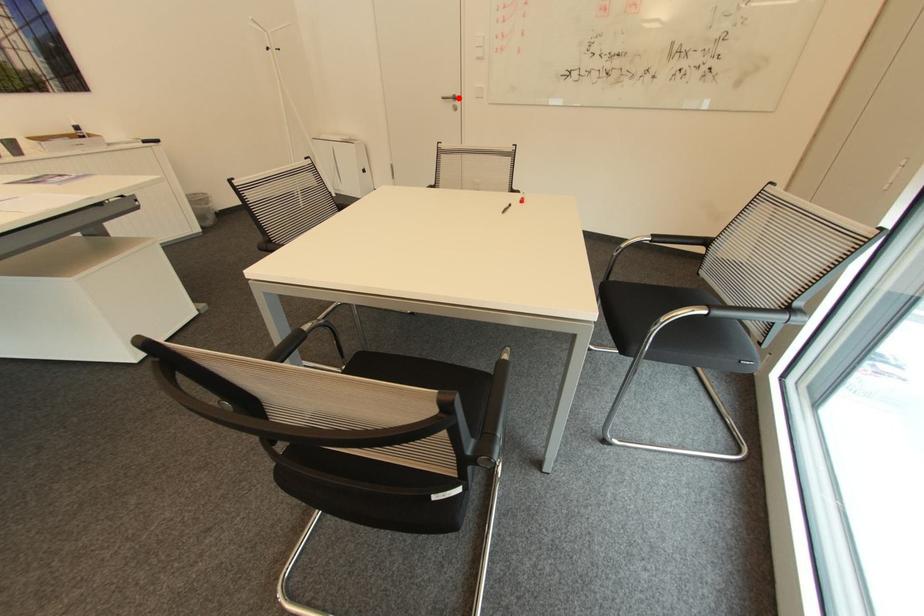
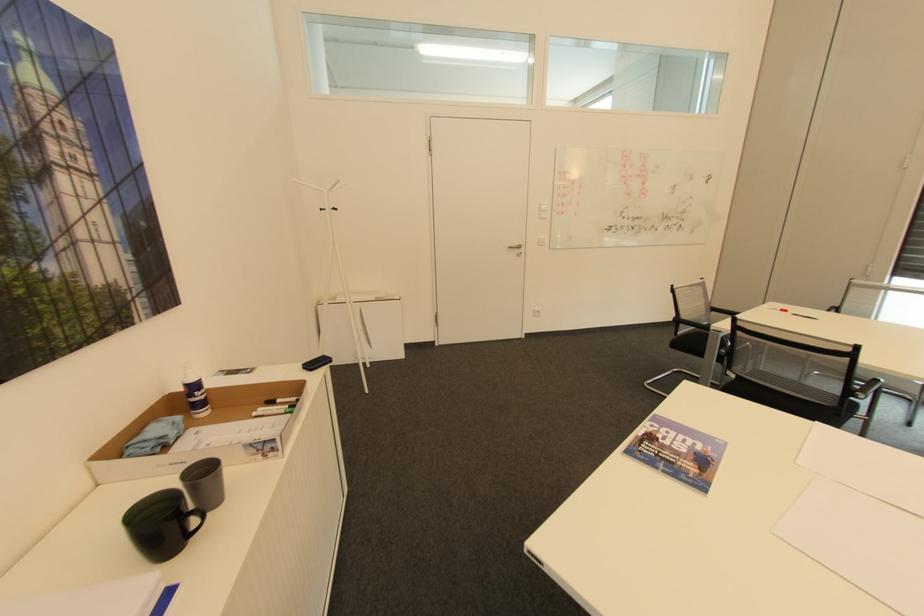
Find the pixel in the second image that matches the highlighted location in the first image.

(524, 246)